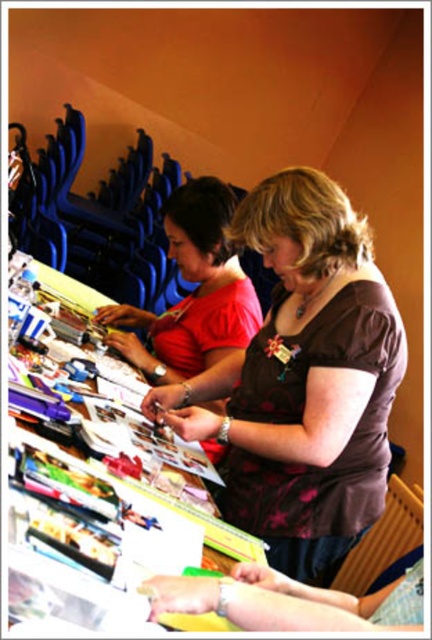
Who is more forward, (288, 387) or (213, 241)?

Point (288, 387) is more forward.

The width and height of the screenshot is (432, 640). What do you see at coordinates (302, 381) in the screenshot? I see `brown textured blouse at center` at bounding box center [302, 381].

I want to click on brown textured blouse at center, so (302, 381).

Who is positioned more to the left, brown textured blouse at center or wooden table at center?

From the viewer's perspective, wooden table at center appears more on the left side.

Is brown textured blouse at center wider than wooden table at center?

Yes.

Between point (301, 396) and point (47, 269), which one is positioned in front?

Point (301, 396) is in front.

What are the coordinates of `brown textured blouse at center` in the screenshot? It's located at (302, 381).

Between wooden table at center and matte red blouse at center, which one is positioned lower?

wooden table at center is below.

Does wooden table at center have a larger size compared to matte red blouse at center?

Incorrect, wooden table at center is not larger than matte red blouse at center.

Does point (175, 564) lie behind point (167, 225)?

No, it is not.

The image size is (432, 640). What are the coordinates of `wooden table at center` in the screenshot? It's located at (104, 538).